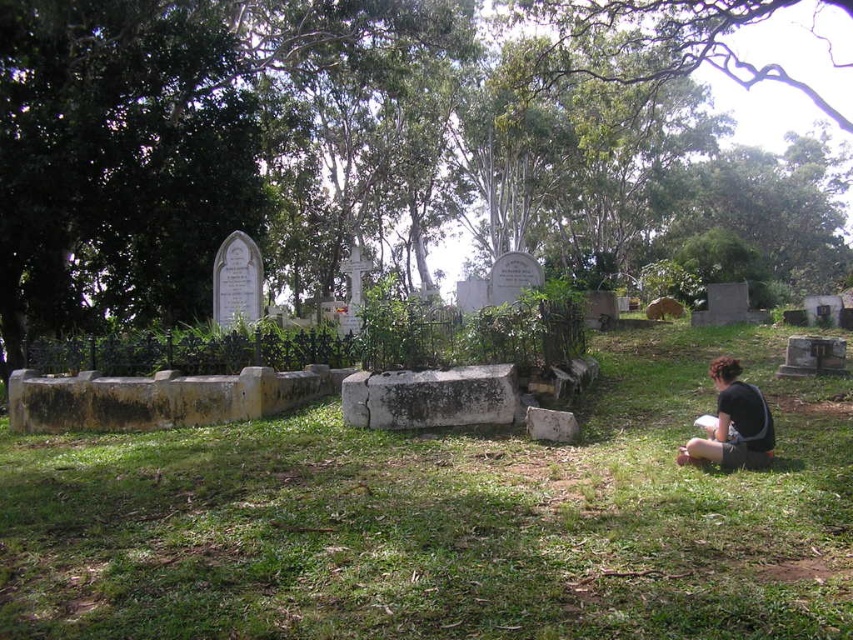
You are standing in the cemetery and see the green leafy tree at center and the black fabric squat at lower right. Which object is closer to the right edge of the image?

The green leafy tree at center is to the right of the black fabric squat at lower right, so the green leafy tree at center is closer to the right edge of the image.

You are standing at the center of the cemetery and want to find the green leafy tree at center. According to the coordinates provided, in which direction should you move to locate it?

The green leafy tree at center is located at coordinates point (380,148). Since you are at the center, you should move towards the lower left direction to reach it.

You are a photographer planning to capture a closeup of the black fabric squat at lower right while ensuring the green grassy at center remains visible in the background. Which object should you focus on to keep both in focus?

The photographer should focus on the black fabric squat at lower right since it is closer to the camera than the green grassy at center, allowing both to be in focus with proper depth of field.